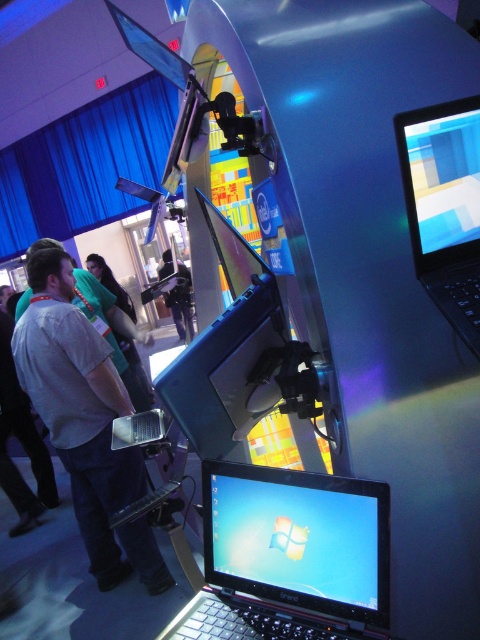
What do you see at coordinates (444, 205) in the screenshot? I see `matte black laptop at upper right` at bounding box center [444, 205].

Can you confirm if matte black laptop at upper right is wider than dark blue fabric jacket at center?

In fact, matte black laptop at upper right might be narrower than dark blue fabric jacket at center.

Describe the element at coordinates (444, 205) in the screenshot. I see `matte black laptop at upper right` at that location.

In order to click on matte black laptop at upper right in this screenshot , I will do `click(444, 205)`.

Who is positioned more to the right, black glossy laptop at center or light gray shirt at center?

Positioned to the right is black glossy laptop at center.

Does point (302, 504) lie in front of point (26, 337)?

Yes, it is.

Is point (348, 486) farther from viewer compared to point (88, 413)?

No, (348, 486) is in front of (88, 413).

Where is `black glossy laptop at center`? black glossy laptop at center is located at coordinates (288, 556).

Is point (104, 518) positioned after point (464, 220)?

Yes, it is behind point (464, 220).

Looking at this image, who is taller, light gray shirt at center or matte black laptop at upper right?

Standing taller between the two is light gray shirt at center.

Is point (41, 412) positioned behind point (433, 202)?

Yes, it is.

Locate an element on the screen. light gray shirt at center is located at coordinates (84, 420).